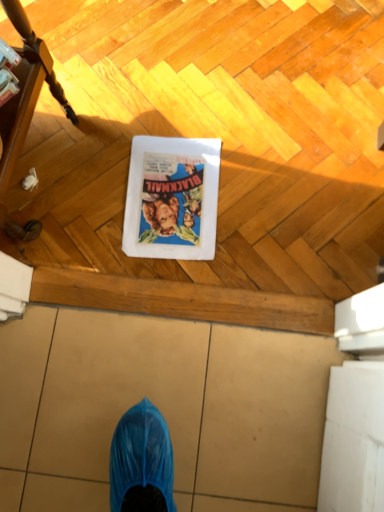
Question: Is matte paper comic book at center surrounded by brushed wood table at left?

Choices:
 (A) yes
 (B) no

Answer: (B)

Question: From a real-world perspective, is brushed wood table at left beneath matte paper comic book at center?

Choices:
 (A) no
 (B) yes

Answer: (A)

Question: Is brushed wood table at left positioned far away from matte paper comic book at center?

Choices:
 (A) yes
 (B) no

Answer: (B)

Question: Does brushed wood table at left appear on the left side of matte paper comic book at center?

Choices:
 (A) yes
 (B) no

Answer: (A)

Question: Is the depth of brushed wood table at left greater than that of matte paper comic book at center?

Choices:
 (A) yes
 (B) no

Answer: (B)

Question: From a real-world perspective, does brushed wood table at left stand above matte paper comic book at center?

Choices:
 (A) yes
 (B) no

Answer: (A)

Question: Considering the relative positions of matte paper comic book at center and brushed wood table at left in the image provided, is matte paper comic book at center in front of brushed wood table at left?

Choices:
 (A) no
 (B) yes

Answer: (A)

Question: Does matte paper comic book at center have a larger size compared to brushed wood table at left?

Choices:
 (A) yes
 (B) no

Answer: (B)

Question: Is matte paper comic book at center oriented away from brushed wood table at left?

Choices:
 (A) yes
 (B) no

Answer: (B)

Question: Can you confirm if matte paper comic book at center is smaller than brushed wood table at left?

Choices:
 (A) no
 (B) yes

Answer: (B)

Question: Is matte paper comic book at center thinner than brushed wood table at left?

Choices:
 (A) yes
 (B) no

Answer: (A)

Question: From the image's perspective, is matte paper comic book at center located above brushed wood table at left?

Choices:
 (A) yes
 (B) no

Answer: (B)

Question: From a real-world perspective, is brushed wood table at left physically located above or below matte paper comic book at center?

Choices:
 (A) above
 (B) below

Answer: (A)